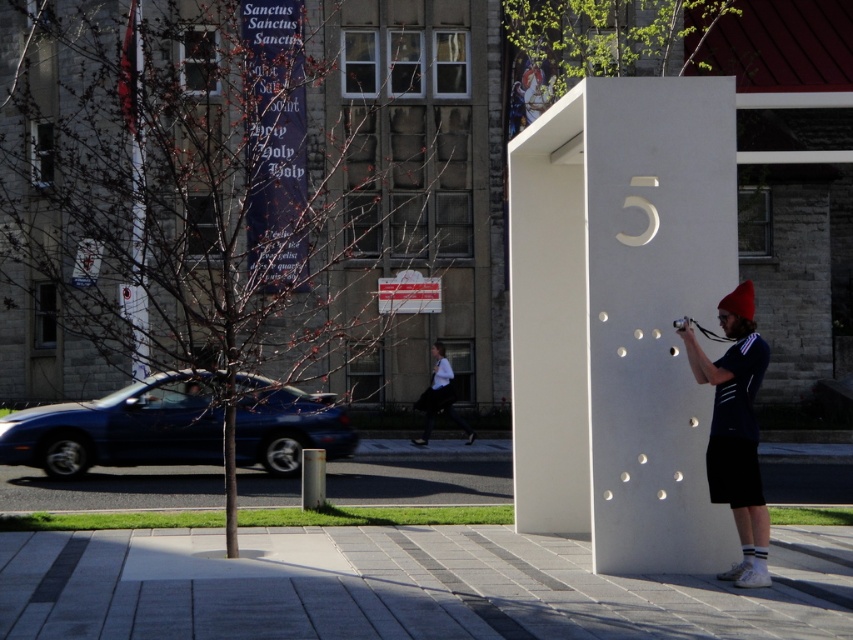
Is matte black shirt at center wider than white shirt at center?

No.

Can you confirm if matte black shirt at center is thinner than white shirt at center?

Correct, matte black shirt at center's width is less than white shirt at center's.

Who is more forward, (759, 579) or (421, 408)?

Point (759, 579)

Where is `matte black shirt at center`? matte black shirt at center is located at coordinates (735, 429).

Who is taller, white smooth pillar at center or matte black shirt at center?

Standing taller between the two is white smooth pillar at center.

How distant is white smooth pillar at center from matte black shirt at center?

white smooth pillar at center and matte black shirt at center are 7.65 feet apart from each other.

Locate an element on the screen. The height and width of the screenshot is (640, 853). white smooth pillar at center is located at coordinates (619, 316).

Where is `white smooth pillar at center`? This screenshot has width=853, height=640. white smooth pillar at center is located at coordinates (619, 316).

Can you confirm if white smooth pillar at center is wider than white shirt at center?

In fact, white smooth pillar at center might be narrower than white shirt at center.

Who is more forward, (694, 388) or (445, 380)?

Point (694, 388) is in front.

The image size is (853, 640). Find the location of `white smooth pillar at center`. white smooth pillar at center is located at coordinates (619, 316).